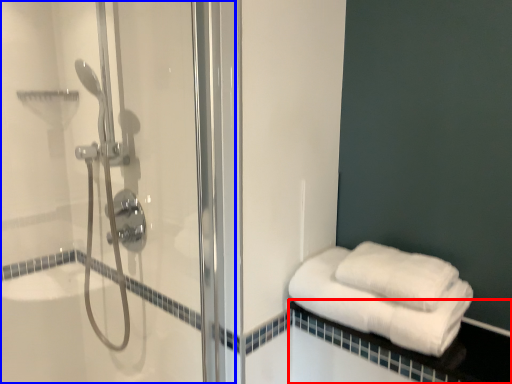
Question: Which of the following is the closest to the observer, balustrade (highlighted by a red box) or shower door (highlighted by a blue box)?

Choices:
 (A) balustrade
 (B) shower door

Answer: (B)